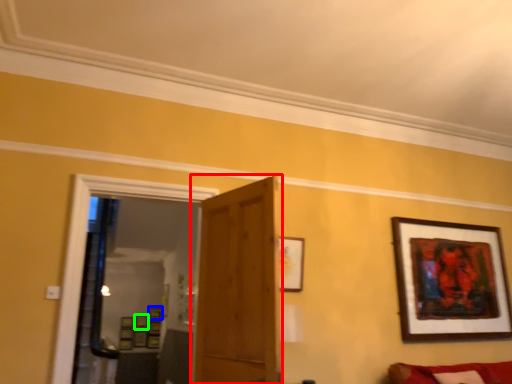
Question: Based on their relative distances, which object is farther from door (highlighted by a red box)? Choose from picture frame (highlighted by a blue box) and picture frame (highlighted by a green box).

Choices:
 (A) picture frame
 (B) picture frame

Answer: (B)